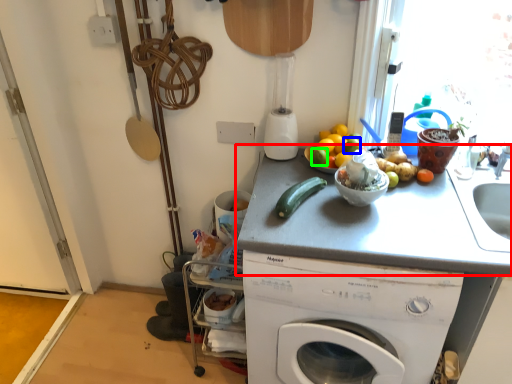
Question: Based on their relative distances, which object is nearer to counter top (highlighted by a red box)? Choose from lime (highlighted by a blue box) and lime (highlighted by a green box).

Choices:
 (A) lime
 (B) lime

Answer: (B)